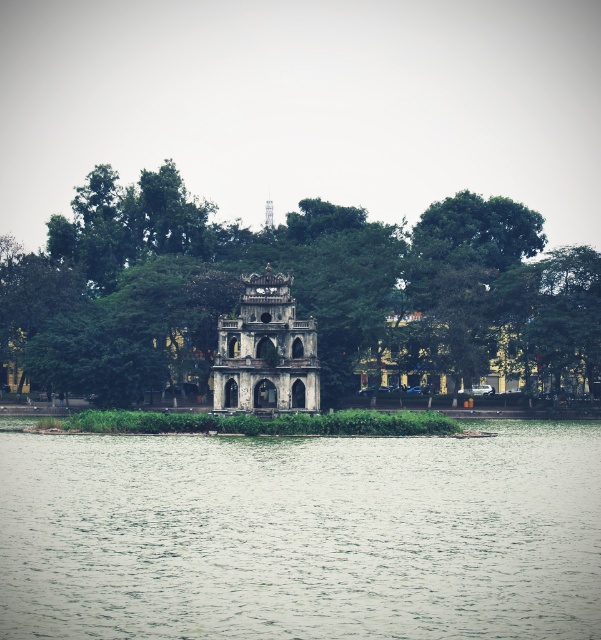
Question: Does green water at center have a greater width compared to green leafy tree at center?

Choices:
 (A) no
 (B) yes

Answer: (A)

Question: Does green water at center have a larger size compared to green leafy tree at center?

Choices:
 (A) no
 (B) yes

Answer: (A)

Question: Which object is farther from the camera taking this photo?

Choices:
 (A) green water at center
 (B) stone aged tower at center
 (C) green leafy tree at center

Answer: (C)

Question: Which point is farther to the camera?

Choices:
 (A) green leafy tree at center
 (B) green water at center

Answer: (A)

Question: Is green leafy tree at center wider than stone aged tower at center?

Choices:
 (A) no
 (B) yes

Answer: (B)

Question: Considering the real-world distances, which object is closest to the green water at center?

Choices:
 (A) green leafy tree at center
 (B) stone aged tower at center

Answer: (B)